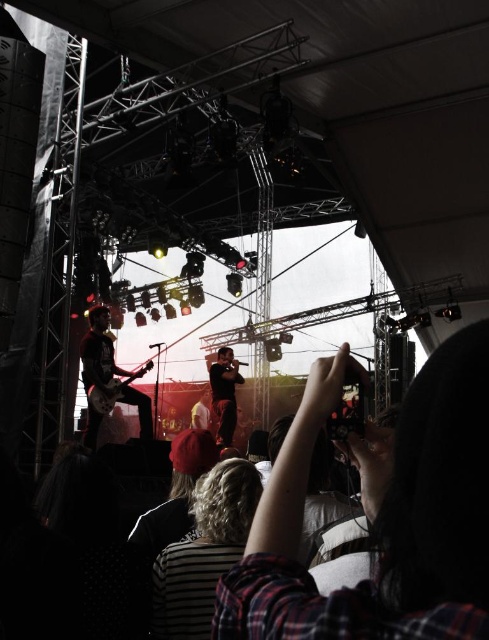
You are a photographer positioned at the center of the stage during the concert. You want to take a photo that includes both the point at coordinates point (343, 630) and point (86, 340). Which point should you focus on first to ensure both are in frame?

You should focus on point (343, 630) first because it is in front of point (86, 340), ensuring both are captured in the frame.

You are a photographer at the concert and want to ensure both the striped fabric shirt at center and the matte black guitar at left are clearly visible in your photo. Given their sizes, which object might require you to adjust your camera focus more carefully to avoid blurriness?

The striped fabric shirt at center has a smaller size compared to the matte black guitar at left, so it might require more careful focus adjustment to ensure clarity in the photo.